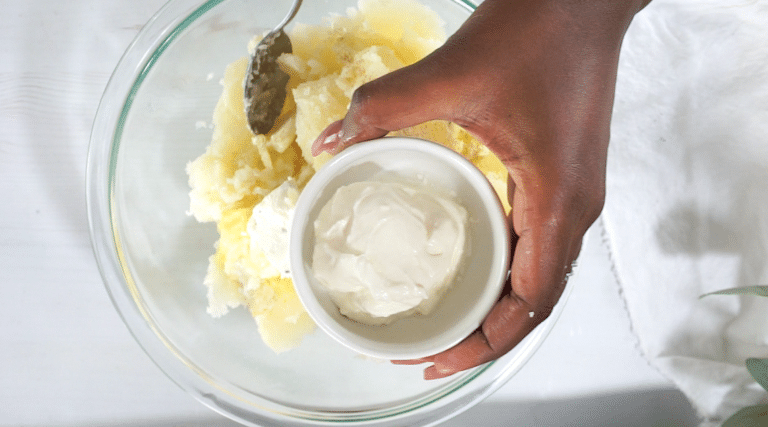
Locate an element on the screen. This screenshot has width=768, height=427. plate is located at coordinates (130, 181).